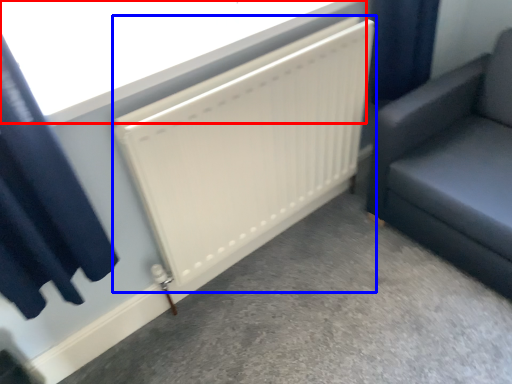
Question: Which object is closer to the camera taking this photo, window screen (highlighted by a red box) or radiator (highlighted by a blue box)?

Choices:
 (A) window screen
 (B) radiator

Answer: (A)